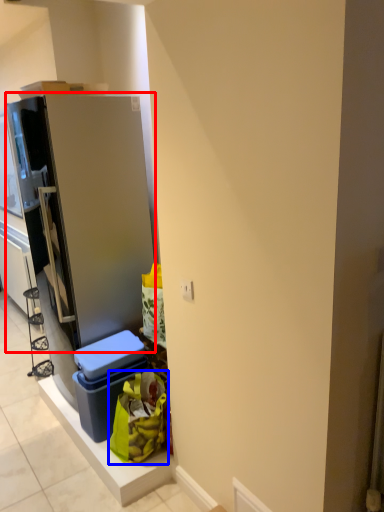
Question: Which point is further to the camera, refrigerator (highlighted by a red box) or garbage (highlighted by a blue box)?

Choices:
 (A) refrigerator
 (B) garbage

Answer: (A)